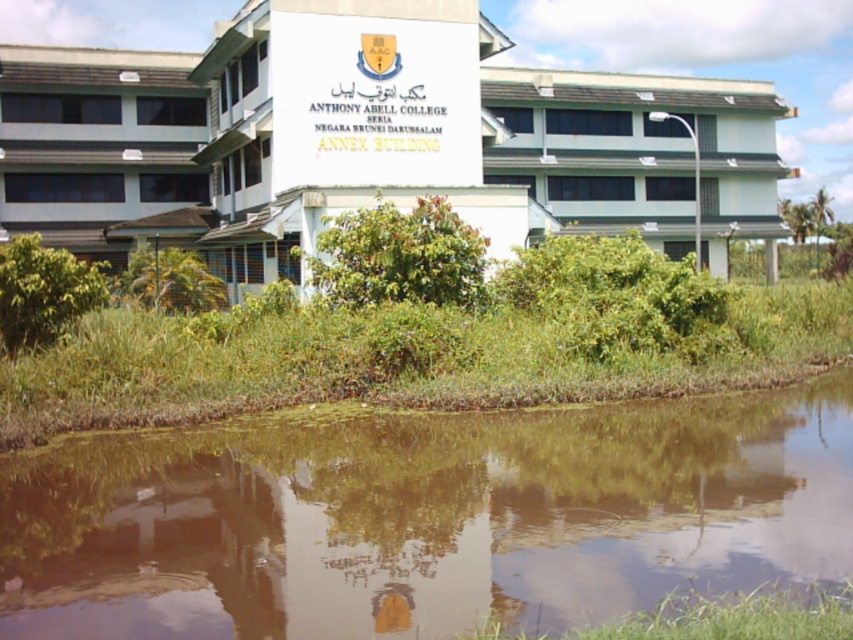
You are a visitor standing at the edge of the green mossy water at lower center. Which direction should you walk to reach the white smooth building at center?

The green mossy water at lower center is in front of the white smooth building at center, so you should walk backward to reach the white smooth building at center.

You are a drone operator planning to capture aerial footage of the green mossy water at lower center and the white smooth building at center. Based on their widths, which object would require a closer camera angle to ensure it fills the frame adequately?

The green mossy water at lower center would require a closer camera angle because its width is less than the white smooth building at center, necessitating a tighter shot to fill the frame appropriately.

You are a visitor standing in front of the white smooth building at center. You want to take a photo of the green mossy water at lower center without the building blocking the view. Is it possible to do so?

The green mossy water at lower center is smaller than the white smooth building at center, so it might be possible to position yourself in a way that avoids the building blocking the view of the water, but the exact feasibility depends on the actual spatial arrangement.